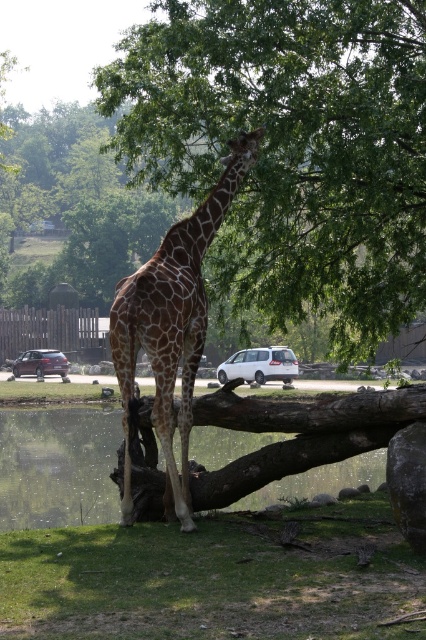
You are standing at the entrance of the zoo enclosure and want to take a photo of the two points marked in the image. Which point, point (236, 364) or point (25, 349), is closer to you?

Point (236, 364) is closer to the viewer than point (25, 349).

You are a zoo visitor standing at the entrance of the giraffe enclosure. You see the green grass at lower center and the matte black suv at center. Which object is closer to your right side?

The green grass at lower center is positioned on the right side of matte black suv at center, so it is closer to your right side.